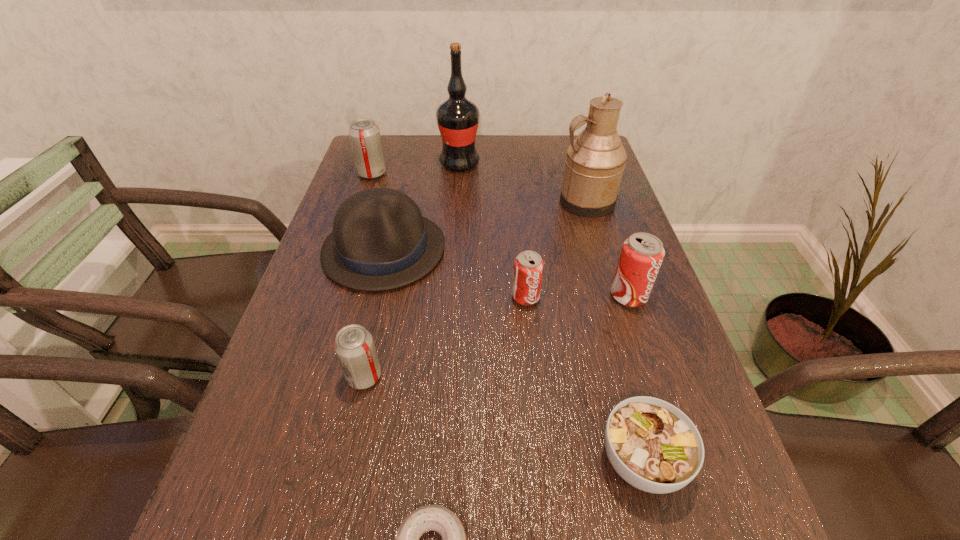
Where is `the smaller gray soda can`? Image resolution: width=960 pixels, height=540 pixels. the smaller gray soda can is located at coordinates (354, 346).

The image size is (960, 540). I want to click on the eighth tallest object, so [x=655, y=447].

You are a GUI agent. You are given a task and a screenshot of the screen. Output one action in this format:
    pyautogui.click(x=<x>, y=<y>)
    Task: Click on the white soup bowl
    The image size is (960, 540).
    Given the screenshot: What is the action you would take?
    pyautogui.click(x=655, y=447)

Locate an element on the screen. This screenshot has height=540, width=960. free space located on the back of the red wine bottle is located at coordinates tap(462, 138).

Identify the location of free space located 0.140m on the left of the eighth shortest object. (506, 201).

Locate an element on the screen. Image resolution: width=960 pixels, height=540 pixels. vacant region located 0.150m on the back of the farther gray soda can is located at coordinates (382, 143).

This screenshot has height=540, width=960. What are the coordinates of `vacant area situated 0.220m on the back of the rightmost soda can` in the screenshot? It's located at (604, 222).

Locate an element on the screen. The width and height of the screenshot is (960, 540). vacant space located 0.290m on the front-facing side of the bowler hat is located at coordinates (344, 419).

What are the coordinates of `free spot located 0.050m on the right of the sixth object from left to right` in the screenshot? It's located at (563, 297).

At what (x,y) coordinates should I click in order to perform the action: click on vacant space located on the right of the right gray soda can. Please return your answer as a coordinate pair (x, y). The image size is (960, 540). Looking at the image, I should click on (559, 377).